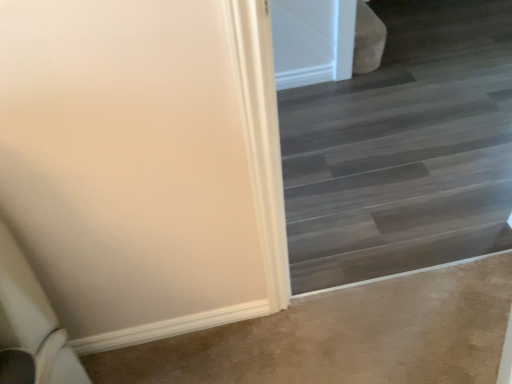
Image resolution: width=512 pixels, height=384 pixels. Identify the location of blank area beneath dark wood floor at center (from a real-world perspective). (398, 252).